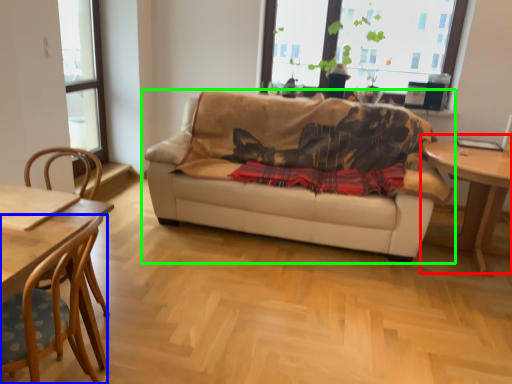
Question: Which is nearer to the table (highlighted by a red box)? chair (highlighted by a blue box) or studio couch (highlighted by a green box).

Choices:
 (A) chair
 (B) studio couch

Answer: (B)